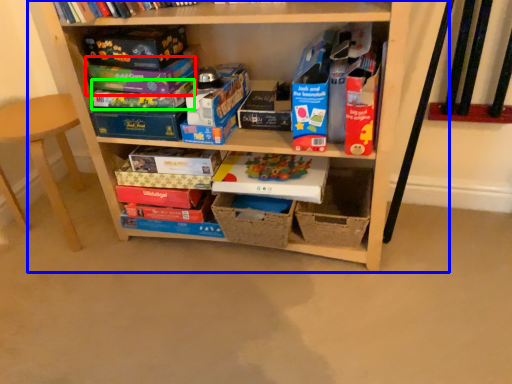
Question: Which object is the closest to the paperback book (highlighted by a red box)? Choose among these: shelf (highlighted by a blue box) or paperback book (highlighted by a green box).

Choices:
 (A) shelf
 (B) paperback book

Answer: (B)